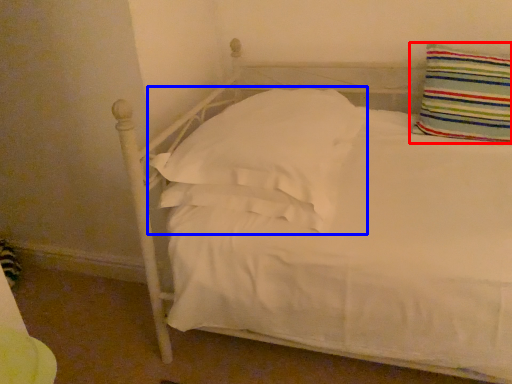
Question: Which object appears farthest to the camera in this image, pillow (highlighted by a red box) or pillow (highlighted by a blue box)?

Choices:
 (A) pillow
 (B) pillow

Answer: (A)